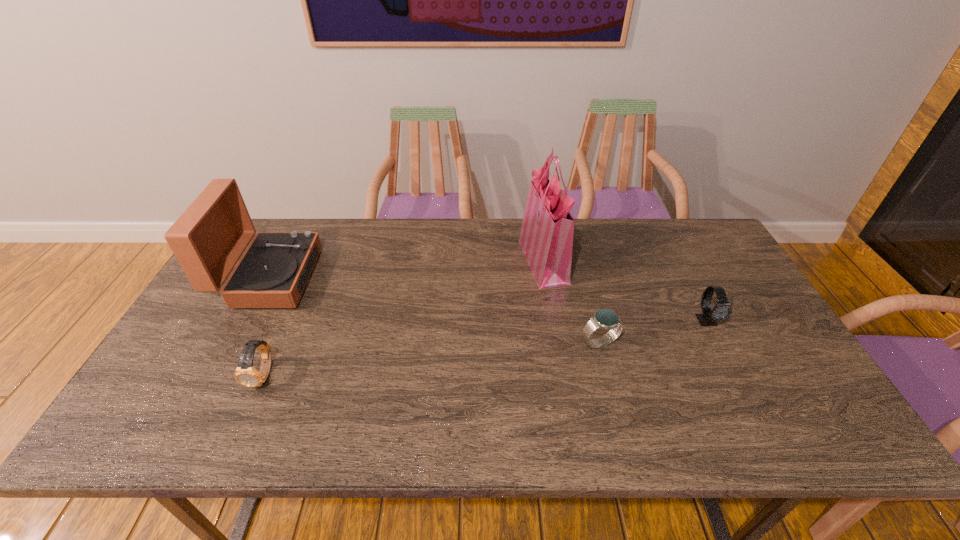
Image resolution: width=960 pixels, height=540 pixels. I want to click on vacant space that satisfies the following two spatial constraints: 1. on the face of the second watch from left to right; 2. on the right side of the fourth shortest object, so click(235, 343).